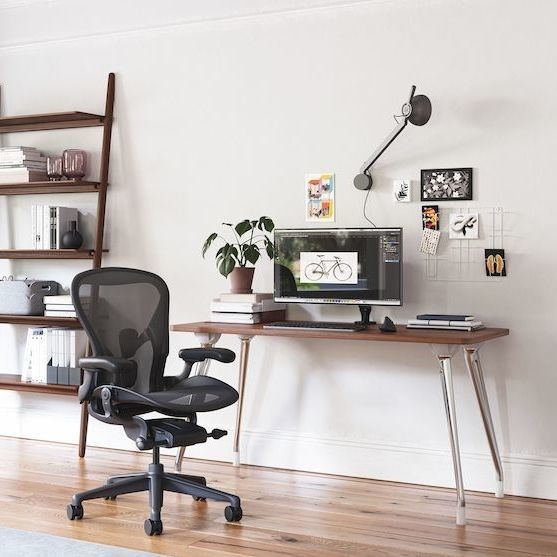
The width and height of the screenshot is (557, 557). I want to click on floor, so click(x=320, y=531).